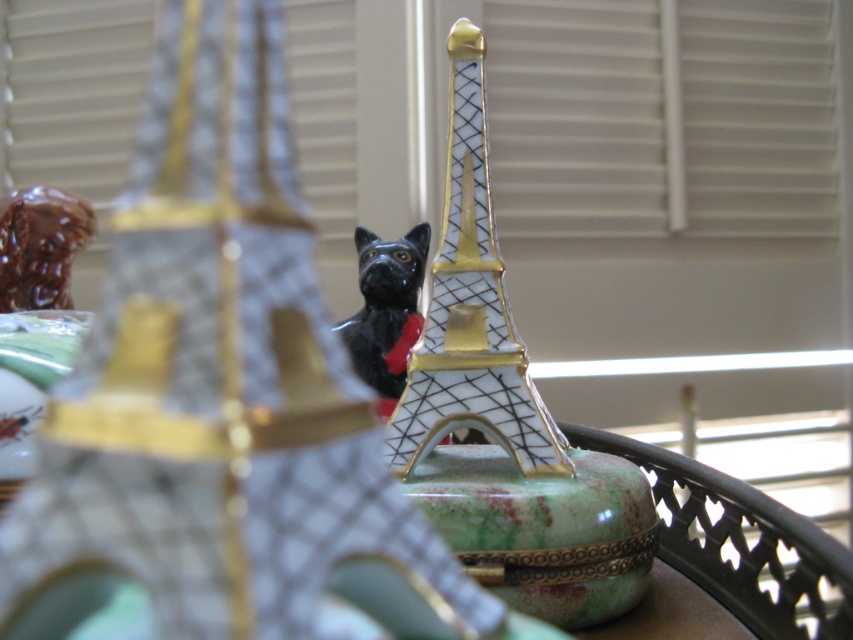
You are an art curator examining two cat figurines displayed in front of an Eiffel Tower model. The scene has a shallow depth of field. Which cat figurine, the matte black cat at center or the black glossy cat at center, appears more out of focus?

The matte black cat at center is in front of the black glossy cat at center. Since the scene has a shallow depth of field, the matte black cat at center would be more out of focus because it is closer to the camera.

You are a photographer setting up a shot with a camera that has a 10 inch wide frame. You want to capture both the porcelain eiffel tower at center and the black glossy cat at center in the same photo. Can both fit within the frame?

The porcelain eiffel tower at center and the black glossy cat at center are 7.83 inches apart from each other. Since the camera frame is 10 inches wide, both objects can fit within the frame as the distance between them is less than the frame width.